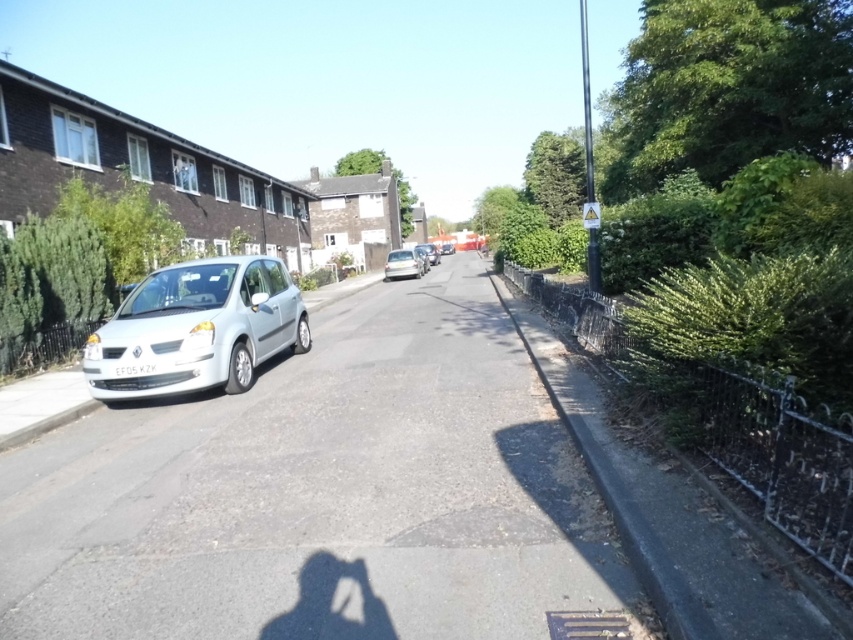
Question: Does white matte car at left have a larger size compared to silver metallic hatchback at center?

Choices:
 (A) yes
 (B) no

Answer: (A)

Question: Which object is farther from the camera taking this photo?

Choices:
 (A) white matte car at left
 (B) silver metallic hatchback at center

Answer: (B)

Question: Which of the following is the closest to the observer?

Choices:
 (A) (404, 276)
 (B) (306, 342)

Answer: (B)

Question: Does white matte car at left appear on the right side of silver metallic hatchback at center?

Choices:
 (A) yes
 (B) no

Answer: (B)

Question: Is white matte car at left positioned behind silver metallic hatchback at center?

Choices:
 (A) no
 (B) yes

Answer: (A)